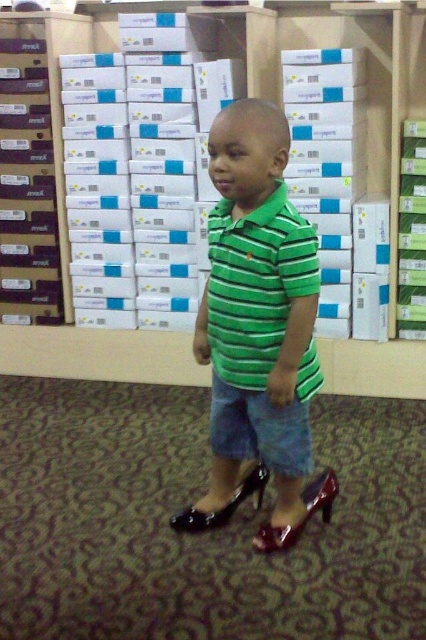
You are a store manager checking inventory and notice two items labeled as the same product in the green striped shirt at center and green striped polo shirt at center. Which one should you select for a customer who prefers a wider fit?

The green striped shirt at center is wider than the green striped polo shirt at center, so you should select the green striped shirt at center for the customer who prefers a wider fit.